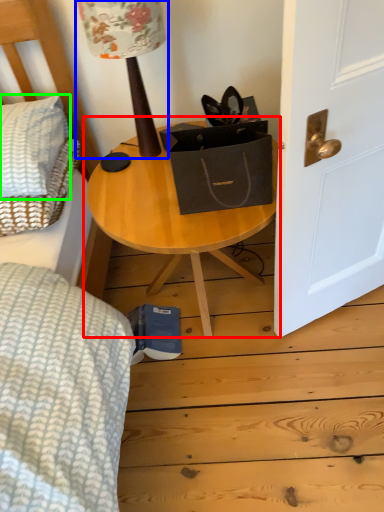
Question: Estimate the real-world distances between objects in this image. Which object is farther from table (highlighted by a red box), table lamp (highlighted by a blue box) or pillow (highlighted by a green box)?

Choices:
 (A) table lamp
 (B) pillow

Answer: (B)